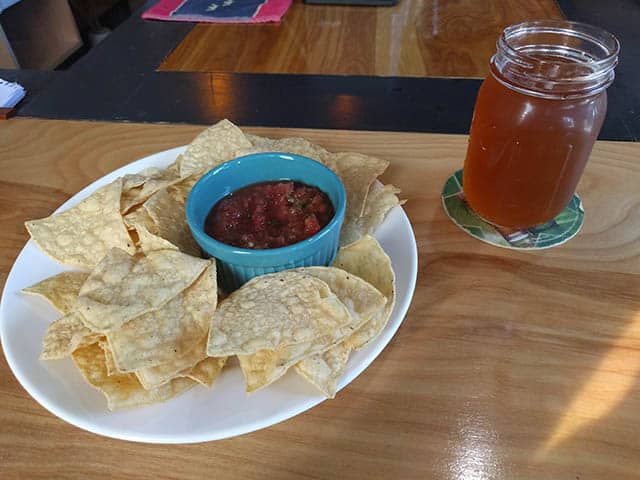
This screenshot has height=480, width=640. Identify the location of wood surface. (504, 369), (370, 31).